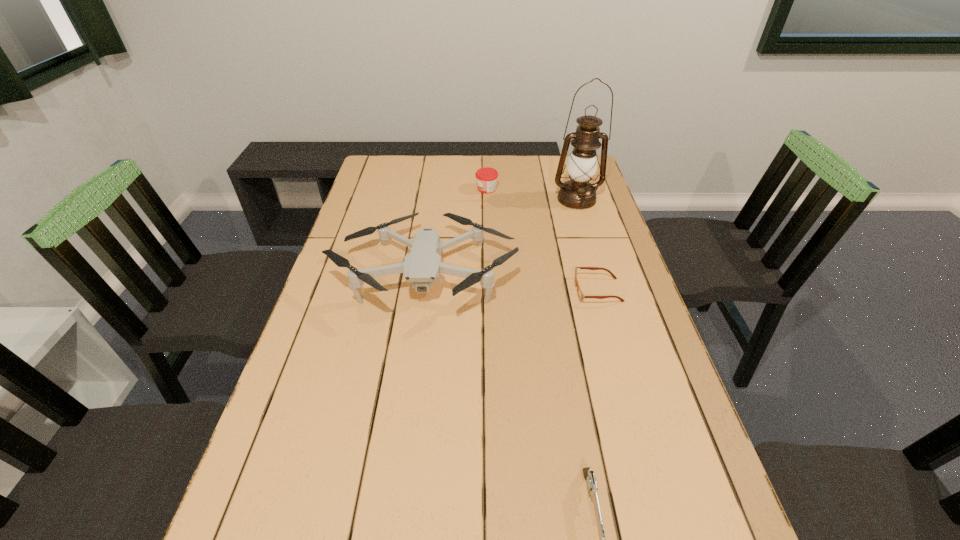
At what (x,y) coordinates should I click in order to perform the action: click on vacant space that is in between the spectacles and the third tallest object. Please return your answer as a coordinate pair (x, y). Looking at the image, I should click on (542, 240).

Where is `free area in between the third shortest object and the second tallest object`? The image size is (960, 540). free area in between the third shortest object and the second tallest object is located at coordinates point(456,232).

Choose which object is the nearest neighbor to the jam. Please provide its 2D coordinates. Your answer should be formatted as a tuple, i.e. [(x, y)], where the tuple contains the x and y coordinates of a point satisfying the conditions above.

[(578, 193)]

Identify which object is located as the third nearest to the oil lamp. Please provide its 2D coordinates. Your answer should be formatted as a tuple, i.e. [(x, y)], where the tuple contains the x and y coordinates of a point satisfying the conditions above.

[(581, 296)]

Locate an element on the screen. vacant point that satisfies the following two spatial constraints: 1. on the label side of the third tallest object; 2. with a camera at the front of the second tallest object is located at coordinates (489, 274).